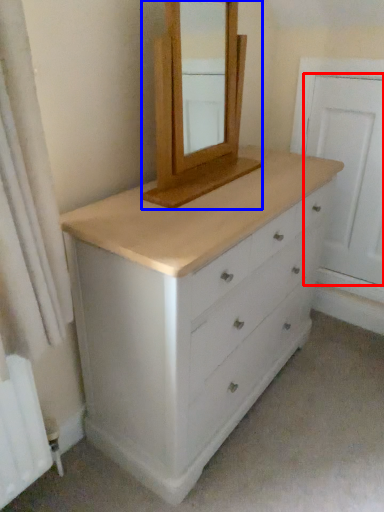
Question: Which point is closer to the camera, screen door (highlighted by a red box) or medicine cabinet (highlighted by a blue box)?

Choices:
 (A) screen door
 (B) medicine cabinet

Answer: (B)